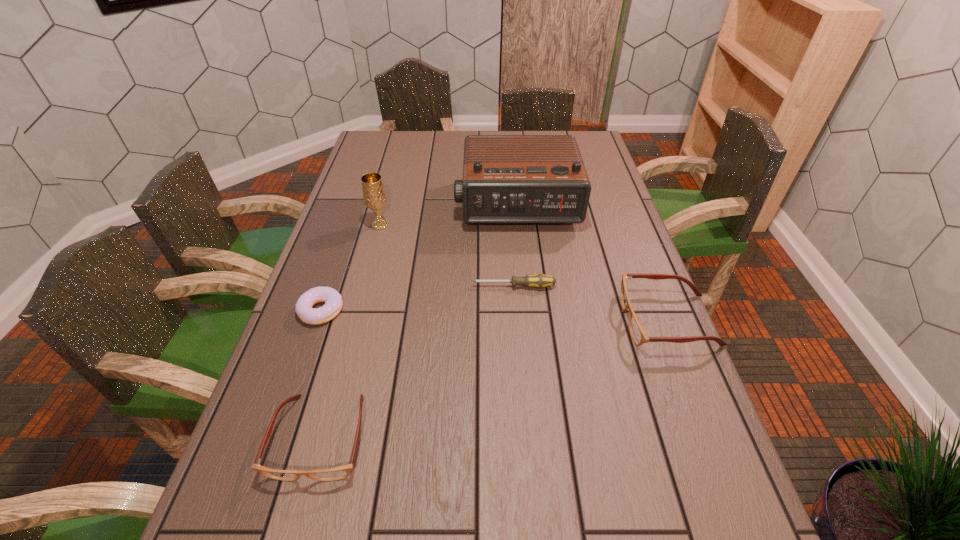
Find the location of a particular element. This screenshot has height=540, width=960. doughnut present at the left edge is located at coordinates (303, 308).

At what (x,y) coordinates should I click in order to perform the action: click on spectacles at the right edge. Please return your answer as a coordinate pair (x, y). Image resolution: width=960 pixels, height=540 pixels. Looking at the image, I should click on (638, 334).

This screenshot has height=540, width=960. In order to click on radio receiver that is at the right edge in this screenshot , I will do `click(506, 178)`.

Where is `object that is at the near left corner`? The image size is (960, 540). object that is at the near left corner is located at coordinates (340, 472).

In the image, there is a desktop. Identify the location of free space at the far edge. The height and width of the screenshot is (540, 960). (517, 133).

At what (x,y) coordinates should I click in order to perform the action: click on free region at the left edge. Please return your answer as a coordinate pair (x, y). Looking at the image, I should click on (336, 257).

You are a GUI agent. You are given a task and a screenshot of the screen. Output one action in this format:
    pyautogui.click(x=<x>, y=<y>)
    Task: Click on the vacant space at the right edge of the desktop
    
    Given the screenshot: What is the action you would take?
    pyautogui.click(x=603, y=245)

The image size is (960, 540). In order to click on free space at the far left corner of the desktop in this screenshot , I will do 397,146.

You are a GUI agent. You are given a task and a screenshot of the screen. Output one action in this format:
    pyautogui.click(x=<x>, y=<y>)
    Task: Click on the vacant space at the near left corner
    The height and width of the screenshot is (540, 960).
    Given the screenshot: What is the action you would take?
    pyautogui.click(x=306, y=502)

In the image, there is a desktop. Identify the location of vacant area at the far right corner. (575, 138).